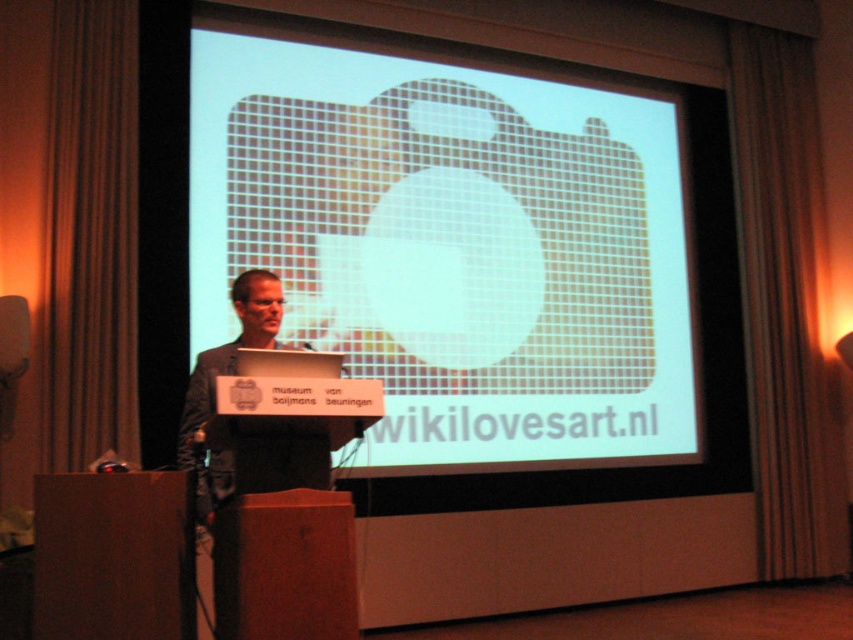
Question: From the image, what is the correct spatial relationship of dark gray suit at center in relation to matte black laptop at center?

Choices:
 (A) above
 (B) below

Answer: (B)

Question: Which point appears farthest from the camera in this image?

Choices:
 (A) tap(335, 376)
 (B) tap(183, 412)
 (C) tap(605, 412)

Answer: (C)

Question: Is white mesh screen at center to the left of dark gray suit at center from the viewer's perspective?

Choices:
 (A) yes
 (B) no

Answer: (B)

Question: Can you confirm if white mesh screen at center is positioned to the left of dark gray suit at center?

Choices:
 (A) no
 (B) yes

Answer: (A)

Question: Estimate the real-world distances between objects in this image. Which object is farther from the matte black laptop at center?

Choices:
 (A) white mesh screen at center
 (B) dark gray suit at center

Answer: (A)

Question: Which point is farther to the camera?

Choices:
 (A) matte black laptop at center
 (B) white mesh screen at center
 (C) dark gray suit at center

Answer: (B)